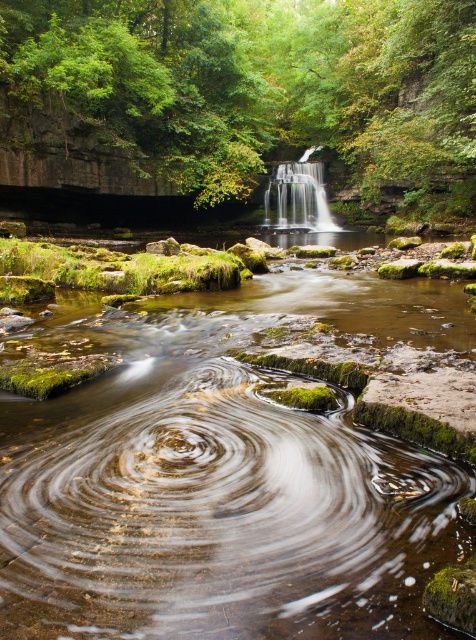
Looking at this image, you are standing at the riverbank and want to take a photo of the green leafy forest at upper center. Based on its position, where should you aim your camera?

The green leafy forest at upper center is located at point (264,84), so you should aim your camera towards the upper center area of the scene to capture it.

You are a hiker who wants to cross the river using a 3.5 meters long rope bridge. The bridge connects the green leafy forest at upper center and the white silky waterfall at center. Will the bridge be long enough to span the gap between them?

The distance between the green leafy forest at upper center and the white silky waterfall at center is 3.51 meters. Since the bridge is only 3.5 meters long, it will be slightly too short to span the gap between them.

You are standing at the riverbank and want to take a photo of both the green leafy forest at upper center and the white silky waterfall at center. Which object should you adjust your camera angle to look up at, and which to look down at?

You should look up at the green leafy forest at upper center and look down at the white silky waterfall at center because the green leafy forest at upper center is above the white silky waterfall at center.